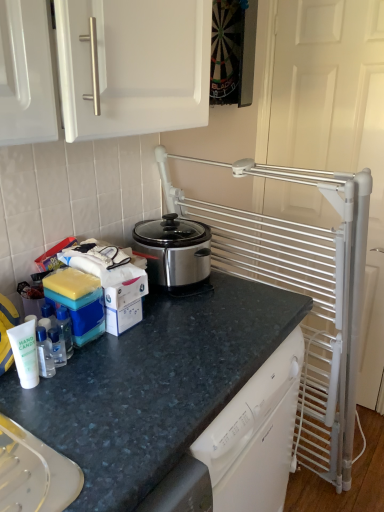
Where is `free space in front of stainless steel slow cooker at center`? Image resolution: width=384 pixels, height=512 pixels. free space in front of stainless steel slow cooker at center is located at coordinates (189, 322).